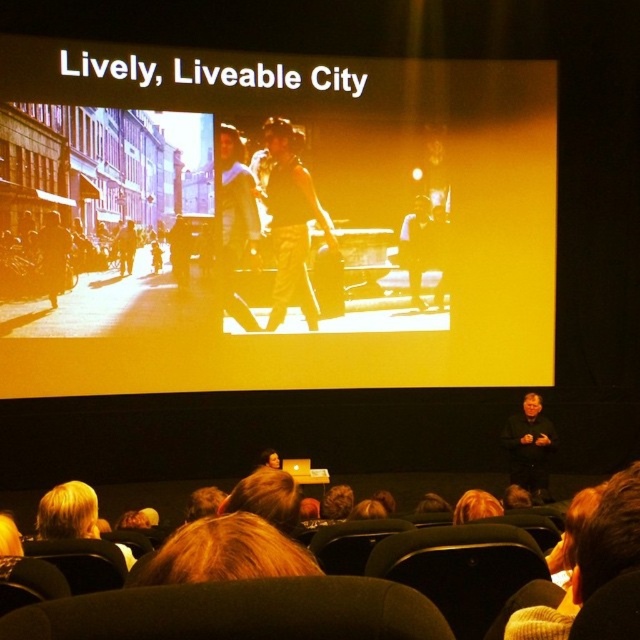
Question: Which point is farther from the camera taking this photo?

Choices:
 (A) (220, 141)
 (B) (54, 294)
 (C) (419, 227)

Answer: (C)

Question: Can you confirm if matte black tank top at center is bigger than matte black dress at center?

Choices:
 (A) yes
 (B) no

Answer: (A)

Question: Which object is the closest to the matte black tank top at center?

Choices:
 (A) dark brown leather jacket at left
 (B) matte black dress at center
 (C) matte black jacket at center
 (D) black fabric at lower right

Answer: (B)

Question: Does sepia-toned photograph of people walking at center have a lesser width compared to black fabric at lower right?

Choices:
 (A) no
 (B) yes

Answer: (B)

Question: Does matte black dress at center appear over dark brown leather jacket at left?

Choices:
 (A) no
 (B) yes

Answer: (B)

Question: Which point appears farthest from the camera in this image?

Choices:
 (A) (540, 483)
 (B) (227, 224)

Answer: (B)